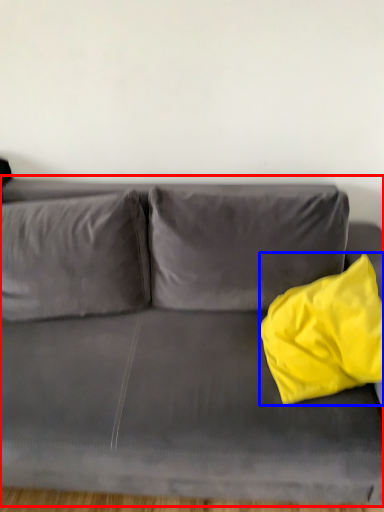
Question: Which point is closer to the camera, studio couch (highlighted by a red box) or throw pillow (highlighted by a blue box)?

Choices:
 (A) studio couch
 (B) throw pillow

Answer: (A)